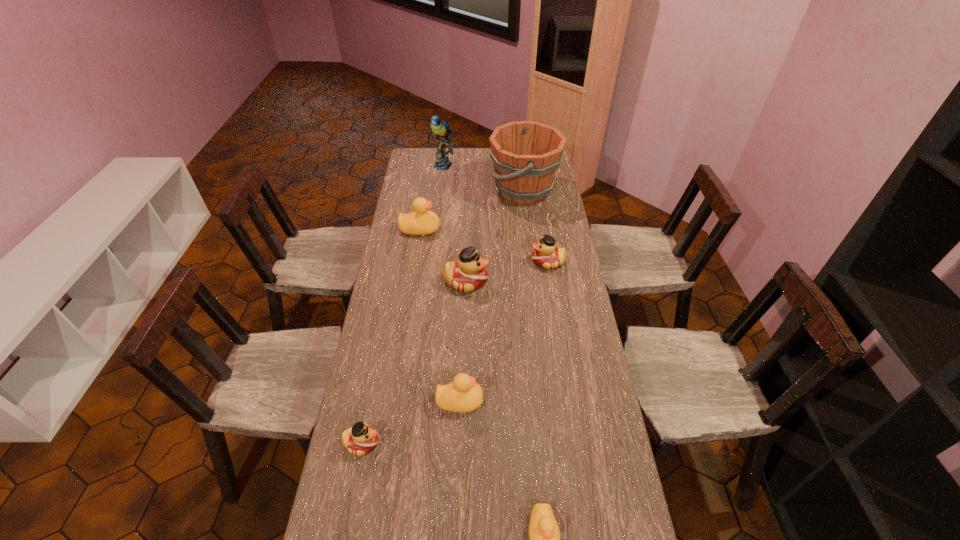
This screenshot has width=960, height=540. Find the location of `vacant region located 0.310m on the face of the second biggest yellow duck`. vacant region located 0.310m on the face of the second biggest yellow duck is located at coordinates (583, 401).

Where is `vacant space located 0.260m on the face of the nearest red duck`? The width and height of the screenshot is (960, 540). vacant space located 0.260m on the face of the nearest red duck is located at coordinates point(470,443).

This screenshot has height=540, width=960. In order to click on parrot present at the far edge in this screenshot , I will do `click(441, 130)`.

The height and width of the screenshot is (540, 960). Find the location of `bucket at the far edge`. bucket at the far edge is located at coordinates (525, 154).

This screenshot has height=540, width=960. Find the location of `parrot that is at the left edge`. parrot that is at the left edge is located at coordinates (441, 130).

Locate an element on the screen. The width and height of the screenshot is (960, 540). bucket at the right edge is located at coordinates (525, 154).

Find the location of a particular element. duck situated at the right edge is located at coordinates (546, 255).

The image size is (960, 540). Identify the location of object located at the far left corner. (441, 130).

Where is `object that is at the far right corner`? object that is at the far right corner is located at coordinates (525, 154).

In the image, there is a desktop. In order to click on free space at the left edge in this screenshot , I will do `click(357, 487)`.